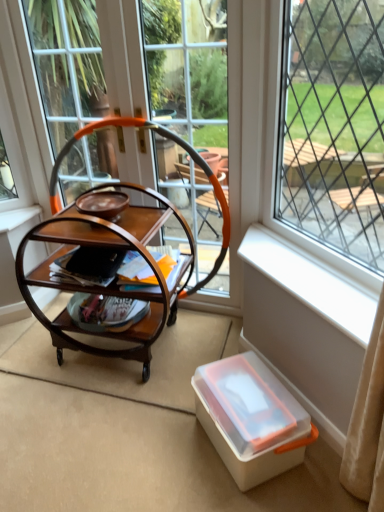
Question: Which direction should I rotate to look at transparent plastic window at center, the 2th window in the left-to-right sequence, — up or down?

Choices:
 (A) up
 (B) down

Answer: (A)

Question: From the image's perspective, is white plastic window sill at lower right over wooden trolley at center?

Choices:
 (A) no
 (B) yes

Answer: (B)

Question: Is white plastic window sill at lower right placed right next to wooden trolley at center?

Choices:
 (A) no
 (B) yes

Answer: (A)

Question: Is white plastic window sill at lower right outside wooden trolley at center?

Choices:
 (A) no
 (B) yes

Answer: (B)

Question: From a real-world perspective, is white plastic window sill at lower right physically below wooden trolley at center?

Choices:
 (A) yes
 (B) no

Answer: (B)

Question: Does white plastic window sill at lower right turn towards wooden trolley at center?

Choices:
 (A) no
 (B) yes

Answer: (A)

Question: Is white plastic window sill at lower right oriented away from wooden trolley at center?

Choices:
 (A) yes
 (B) no

Answer: (B)

Question: From a real-world perspective, is translucent plastic box at lower right located beneath matte brown magazine at center?

Choices:
 (A) no
 (B) yes

Answer: (B)

Question: Considering the relative sizes of translucent plastic box at lower right and matte brown magazine at center in the image provided, is translucent plastic box at lower right bigger than matte brown magazine at center?

Choices:
 (A) no
 (B) yes

Answer: (B)

Question: Is the depth of translucent plastic box at lower right less than that of matte brown magazine at center?

Choices:
 (A) no
 (B) yes

Answer: (B)

Question: Is translucent plastic box at lower right completely or partially outside of matte brown magazine at center?

Choices:
 (A) yes
 (B) no

Answer: (A)

Question: Is translucent plastic box at lower right looking in the opposite direction of matte brown magazine at center?

Choices:
 (A) yes
 (B) no

Answer: (B)

Question: Is translucent plastic box at lower right aimed at matte brown magazine at center?

Choices:
 (A) yes
 (B) no

Answer: (B)

Question: Can you confirm if matte brown magazine at center is wider than wooden trolley at center?

Choices:
 (A) yes
 (B) no

Answer: (B)